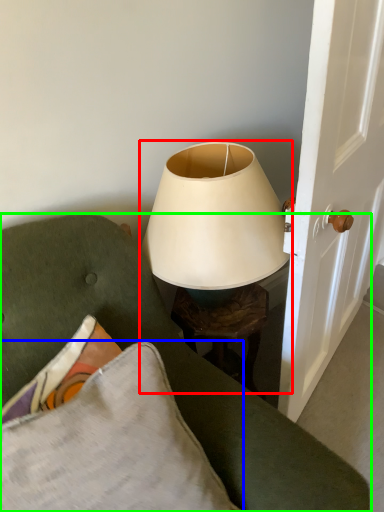
Question: Which object is the farthest from lamp (highlighted by a red box)? Choose among these: pillow (highlighted by a blue box) or furniture (highlighted by a green box).

Choices:
 (A) pillow
 (B) furniture

Answer: (A)